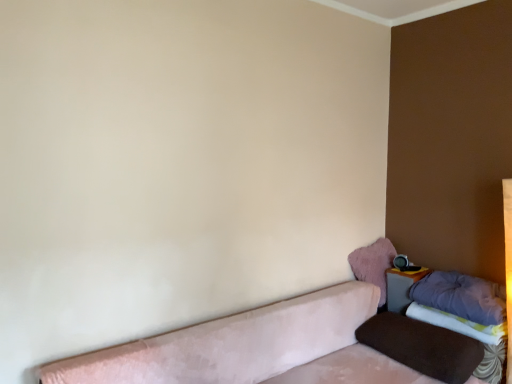
Question: Based on their sizes in the image, would you say brown velvety pillow at lower right, arranged as the 1th pillow when ordered from the bottom, is bigger or smaller than matte gray table at lower right?

Choices:
 (A) big
 (B) small

Answer: (A)

Question: Is brown velvety pillow at lower right, arranged as the 1th pillow when ordered from the bottom, in front of or behind matte gray table at lower right in the image?

Choices:
 (A) behind
 (B) front

Answer: (B)

Question: Estimate the real-world distances between objects in this image. Which object is farther from the purple fabric sheet at lower right?

Choices:
 (A) purple soft pillow at right, arranged as the second pillow when viewed from the top
 (B) velvet pink couch at lower left
 (C) brown velvety pillow at lower right, arranged as the 1th pillow when ordered from the bottom
 (D) fuzzy pink pillow at upper right, positioned as the 3th pillow in bottom-to-top order
 (E) matte gray table at lower right

Answer: (B)

Question: Based on their relative distances, which object is nearer to the fuzzy pink pillow at upper right, positioned as the 3th pillow in bottom-to-top order?

Choices:
 (A) purple soft pillow at right, the second pillow from the bottom
 (B) matte gray table at lower right
 (C) brown velvety pillow at lower right, arranged as the 1th pillow when ordered from the bottom
 (D) purple fabric sheet at lower right
 (E) velvet pink couch at lower left

Answer: (B)